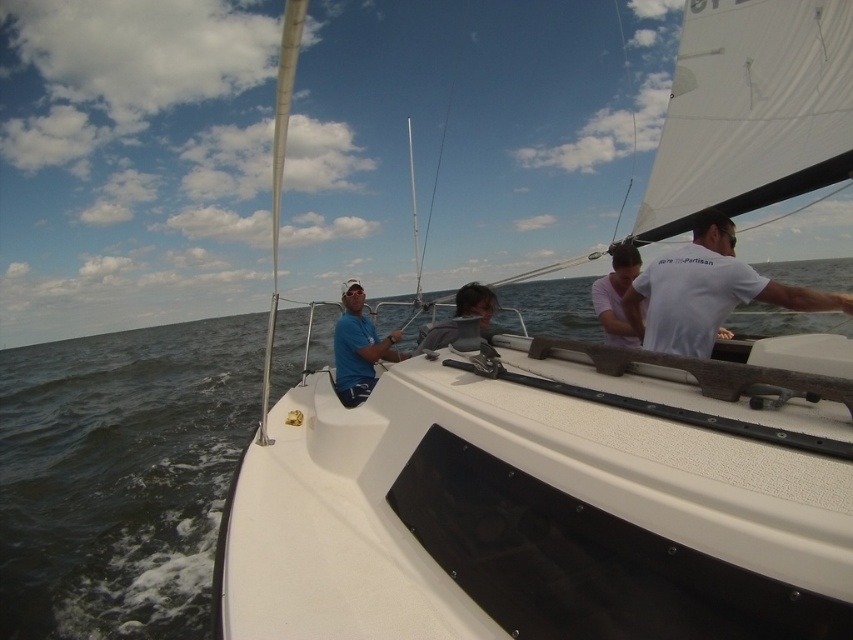
This screenshot has height=640, width=853. What do you see at coordinates (706, 291) in the screenshot? I see `white cotton shirt at right` at bounding box center [706, 291].

Can you confirm if white cotton shirt at right is positioned to the left of matte blue shirt at center?

Incorrect, white cotton shirt at right is not on the left side of matte blue shirt at center.

Which is behind, point (824, 310) or point (381, 346)?

Point (381, 346)

Where is `white cotton shirt at right`? This screenshot has width=853, height=640. white cotton shirt at right is located at coordinates (706, 291).

Which of these two, dark blue water at center or matte blue shirt at center, stands taller?

dark blue water at center

Does dark blue water at center have a larger size compared to matte blue shirt at center?

Indeed, dark blue water at center has a larger size compared to matte blue shirt at center.

Describe the element at coordinates (117, 474) in the screenshot. I see `dark blue water at center` at that location.

Where is `dark blue water at center`? Image resolution: width=853 pixels, height=640 pixels. dark blue water at center is located at coordinates (117, 474).

Can you confirm if matte blue shirt at center is positioned to the left of pink matte shirt at center?

Indeed, matte blue shirt at center is positioned on the left side of pink matte shirt at center.

What do you see at coordinates (358, 348) in the screenshot? I see `matte blue shirt at center` at bounding box center [358, 348].

Is point (373, 348) more distant than point (601, 310)?

Yes, it is behind point (601, 310).

Locate an element on the screen. Image resolution: width=853 pixels, height=640 pixels. matte blue shirt at center is located at coordinates (358, 348).